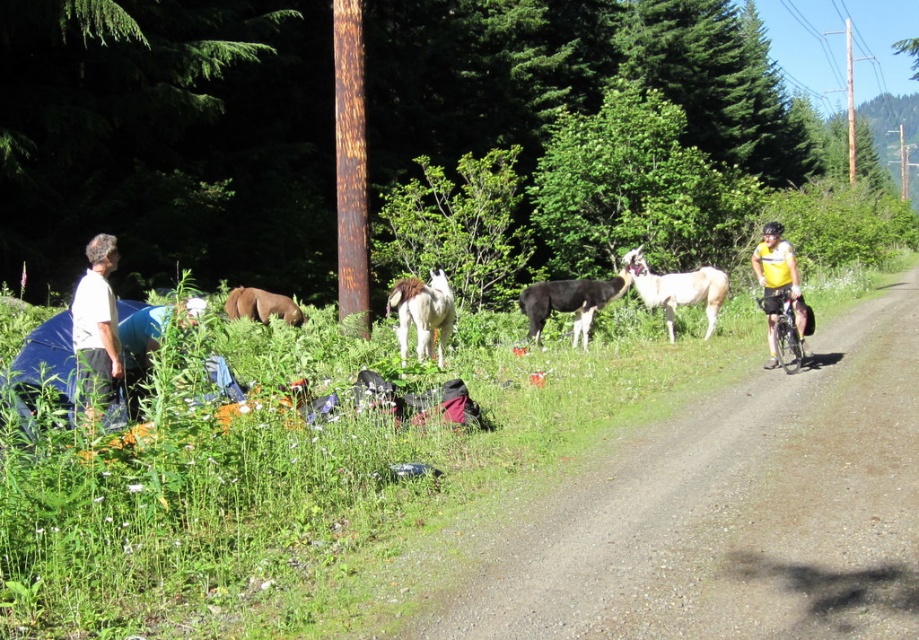
You are standing at the campsite and want to wave to both the yellow jersey cyclist at right and the brown fuzzy pony at lower left. Which one will you see first as you look from left to right?

You will see the brown fuzzy pony at lower left first when looking from left to right because the yellow jersey cyclist at right is positioned to the right of the brown fuzzy pony at lower left.

You are a hiker who wants to cross the dirt road safely. There is a yellow jersey cyclist at right and a brown fuzzy pony at lower left. Which direction should you wait for the cyclist to pass before crossing?

The yellow jersey cyclist at right and brown fuzzy pony at lower left are 6.05 meters apart from each other. Since the cyclist is at the right, you should wait for the cyclist to pass before crossing the road from the left side towards the brown fuzzy pony at lower left.